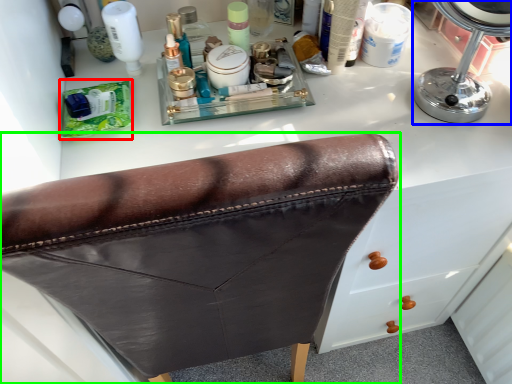
Question: Which object is positioned farthest from product (highlighted by a red box)? Select from mirror (highlighted by a blue box) and furniture (highlighted by a green box).

Choices:
 (A) mirror
 (B) furniture

Answer: (A)